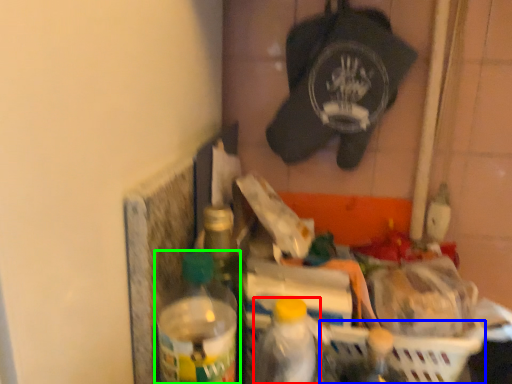
Question: Which object is the closest to the bottle (highlighted by a red box)? Choose among these: basket (highlighted by a blue box) or bottle (highlighted by a green box).

Choices:
 (A) basket
 (B) bottle

Answer: (B)